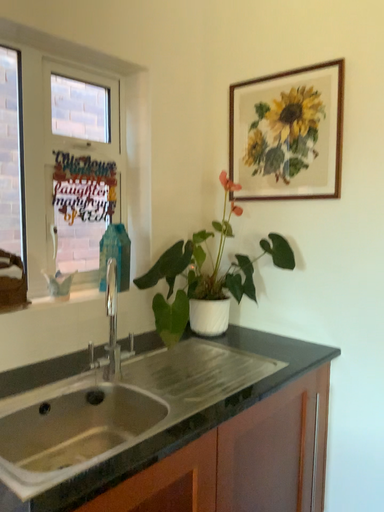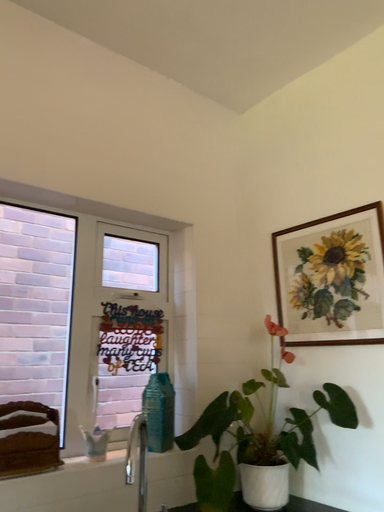
Question: Which way did the camera rotate in the video?

Choices:
 (A) rotated downward
 (B) rotated upward

Answer: (B)